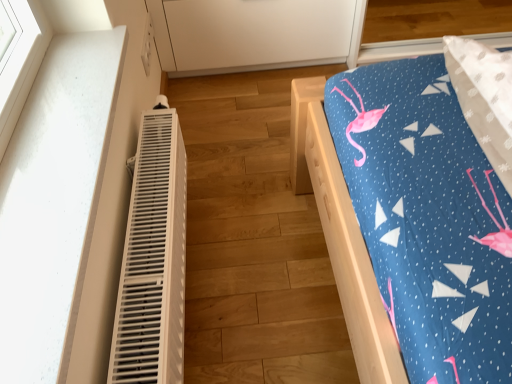
Where is `free space above white plastic heater at left (from a real-world perspective)`? free space above white plastic heater at left (from a real-world perspective) is located at coordinates (142, 212).